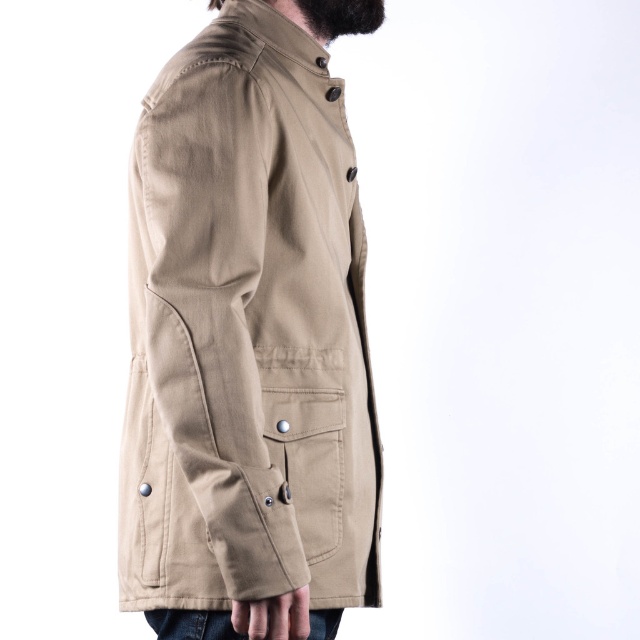
Question: Is matte khaki pocket at center smaller than black fuzzy beard at upper center?

Choices:
 (A) yes
 (B) no

Answer: (B)

Question: Which object is the farthest from the matte khaki pocket at center?

Choices:
 (A) beige cotton coat at center
 (B) black fuzzy beard at upper center

Answer: (B)

Question: Can you confirm if matte khaki pocket at center is wider than black fuzzy beard at upper center?

Choices:
 (A) yes
 (B) no

Answer: (B)

Question: Which object is the farthest from the black fuzzy beard at upper center?

Choices:
 (A) beige cotton coat at center
 (B) matte khaki pocket at center

Answer: (B)

Question: Among these objects, which one is nearest to the camera?

Choices:
 (A) black fuzzy beard at upper center
 (B) beige cotton coat at center
 (C) matte khaki pocket at center

Answer: (B)

Question: Can you confirm if beige cotton coat at center is bigger than black fuzzy beard at upper center?

Choices:
 (A) no
 (B) yes

Answer: (B)